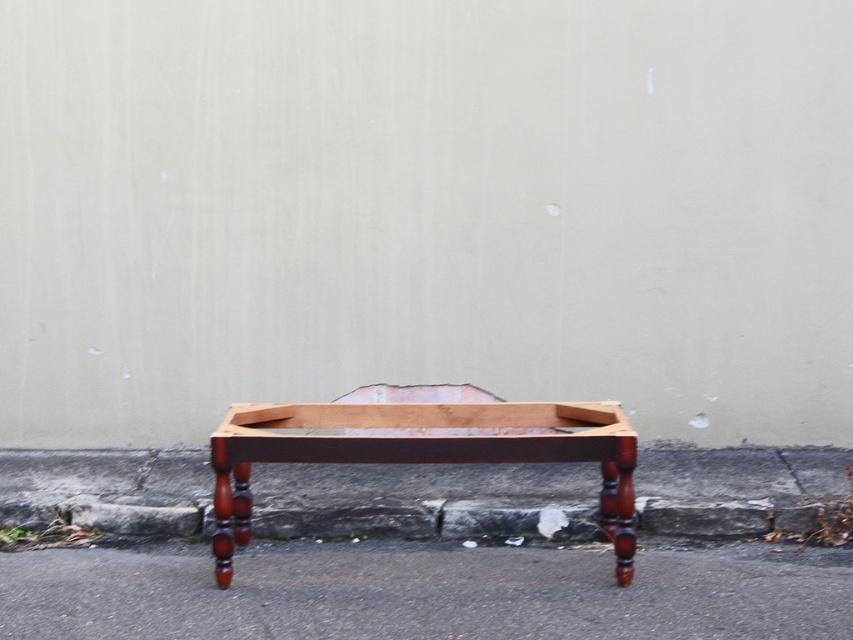
What do you see at coordinates (424, 593) in the screenshot?
I see `smooth asphalt at lower center` at bounding box center [424, 593].

Is smooth asphalt at lower center taller than mahogany wood table at center?

No, smooth asphalt at lower center is not taller than mahogany wood table at center.

Which is behind, point (94, 618) or point (415, 406)?

Positioned behind is point (415, 406).

Find the location of `smooth asphalt at lower center`. smooth asphalt at lower center is located at coordinates (424, 593).

Between point (170, 600) and point (16, 516), which one is positioned behind?

Point (16, 516)

Can you confirm if smooth asphalt at lower center is bigger than gray concrete curb at lower center?

Yes, smooth asphalt at lower center is bigger than gray concrete curb at lower center.

Find the location of a particular element. The width and height of the screenshot is (853, 640). smooth asphalt at lower center is located at coordinates (424, 593).

Is mahogany wood table at center positioned behind gray concrete curb at lower center?

No.

Describe the element at coordinates (422, 451) in the screenshot. I see `mahogany wood table at center` at that location.

Does point (364, 440) come in front of point (126, 532)?

Yes, point (364, 440) is closer to viewer.

What are the coordinates of `mahogany wood table at center` in the screenshot? It's located at (422, 451).